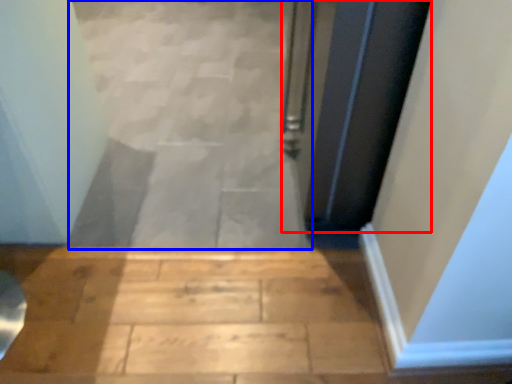
Question: Which object appears closest to the camera in this image, door (highlighted by a red box) or stairwell (highlighted by a blue box)?

Choices:
 (A) door
 (B) stairwell

Answer: (A)